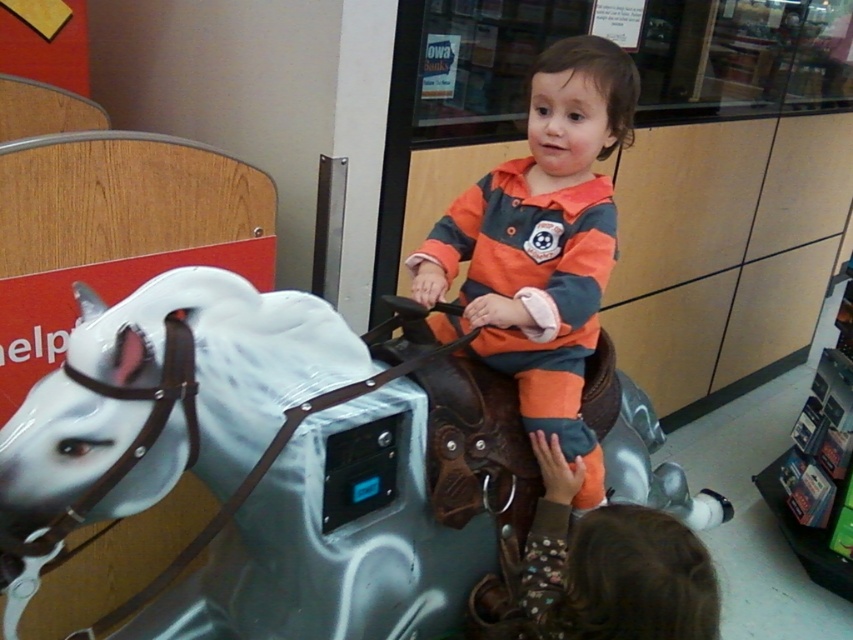
This screenshot has height=640, width=853. Find the location of `white glossy horse at center`. white glossy horse at center is located at coordinates (239, 465).

Does white glossy horse at center have a lesser height compared to orange striped sweater at center?

Yes.

Is point (279, 291) positioned in front of point (599, 220)?

No, (279, 291) is further to viewer.

Find the location of a particular element. The height and width of the screenshot is (640, 853). white glossy horse at center is located at coordinates (239, 465).